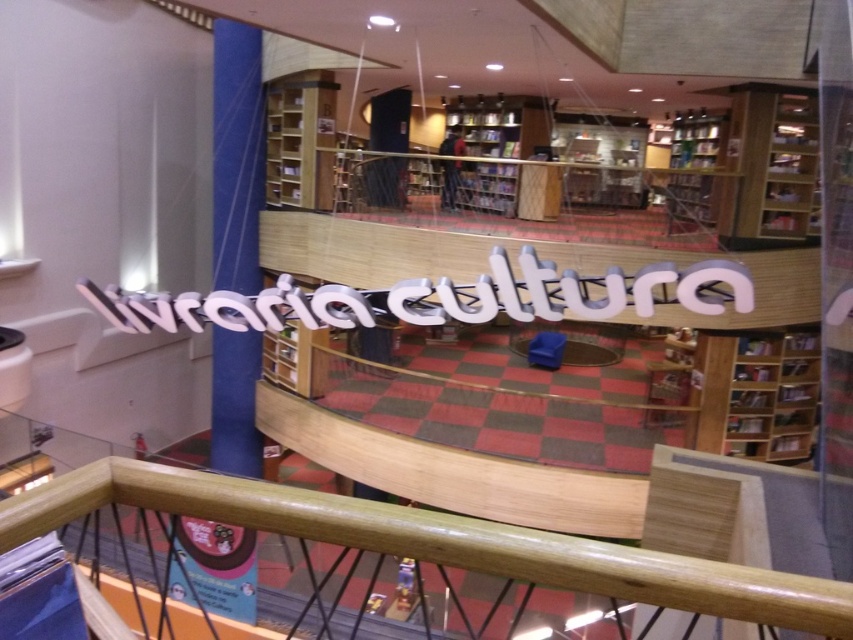
Between point (809, 332) and point (276, 177), which one is positioned behind?

Positioned behind is point (276, 177).

From the picture: Can you confirm if wooden bookshelf at lower right is taller than wooden bookshelf at center?

Incorrect, wooden bookshelf at lower right's height is not larger of wooden bookshelf at center's.

Locate an element on the screen. This screenshot has height=640, width=853. wooden bookshelf at lower right is located at coordinates (755, 394).

Measure the distance between wooden bookshelf at center and wooden bookshelf at upper right.

wooden bookshelf at center and wooden bookshelf at upper right are 5.70 meters apart.

Who is positioned more to the left, wooden bookshelf at center or wooden bookshelf at upper right?

wooden bookshelf at center

Find the location of `wooden bookshelf at center`. wooden bookshelf at center is located at coordinates (300, 140).

Between glossy wood rail at center and wooden bookshelf at upper right, which one appears on the left side from the viewer's perspective?

From the viewer's perspective, glossy wood rail at center appears more on the left side.

Does glossy wood rail at center appear on the right side of wooden bookshelf at upper right?

Incorrect, glossy wood rail at center is not on the right side of wooden bookshelf at upper right.

Describe the element at coordinates (438, 541) in the screenshot. The image size is (853, 640). I see `glossy wood rail at center` at that location.

This screenshot has width=853, height=640. I want to click on glossy wood rail at center, so click(x=438, y=541).